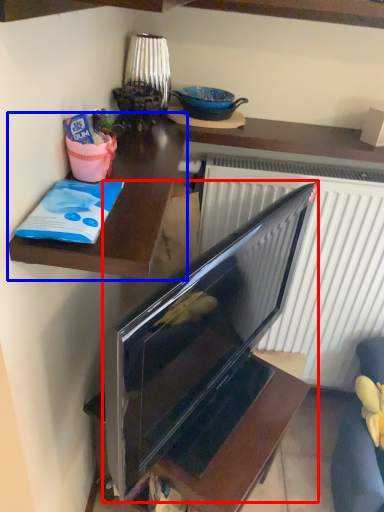
Question: Which point is further to the camera, television (highlighted by a red box) or desk (highlighted by a blue box)?

Choices:
 (A) television
 (B) desk

Answer: (B)